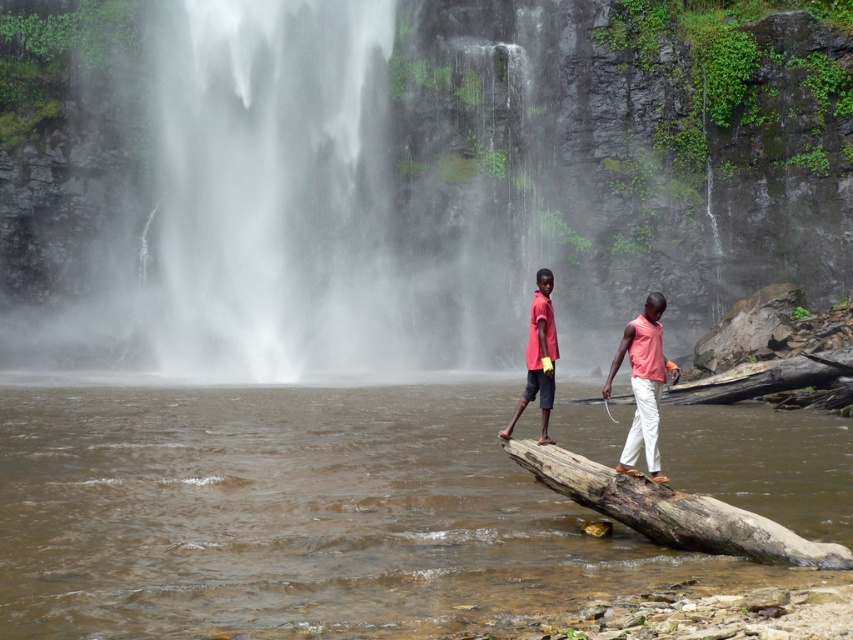
You are a photographer planning to capture a photo of the brown muddy water at center and the brown weathered log at center. To ensure both are in frame, should you adjust your camera to focus on the left or the right side of the scene?

The brown muddy water at center is to the left of the brown weathered log at center, so you should focus on the left side to include both in the frame.

You are a hiker trying to cross the river using the brown weathered log at center. The brown muddy water at center is flowing swiftly. Based on the scene, can you safely step onto the log without getting your feet wet?

The brown muddy water at center is much taller than the brown weathered log at center, so stepping onto the log would likely result in getting your feet wet because the water level is higher than the log.